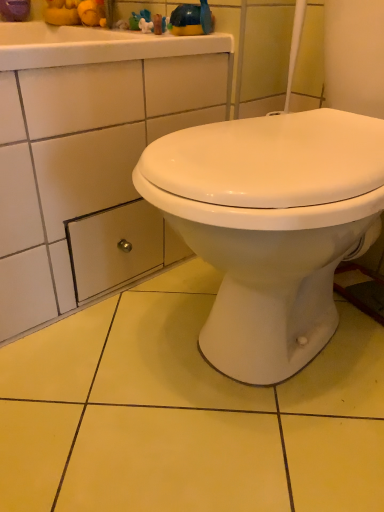
Question: Considering the positions of point (82, 276) and point (175, 31), is point (82, 276) closer or farther from the camera than point (175, 31)?

Choices:
 (A) farther
 (B) closer

Answer: (A)

Question: Considering the positions of metallic silver drawer at lower left and blue rubber duck at upper center in the image, is metallic silver drawer at lower left bigger or smaller than blue rubber duck at upper center?

Choices:
 (A) small
 (B) big

Answer: (B)

Question: From a real-world perspective, is metallic silver drawer at lower left above or below blue rubber duck at upper center?

Choices:
 (A) below
 (B) above

Answer: (A)

Question: From the image's perspective, is blue rubber duck at upper center above or below metallic silver drawer at lower left?

Choices:
 (A) below
 (B) above

Answer: (B)

Question: Is point (203, 18) positioned closer to the camera than point (117, 238)?

Choices:
 (A) farther
 (B) closer

Answer: (B)

Question: Is blue rubber duck at upper center bigger or smaller than metallic silver drawer at lower left?

Choices:
 (A) big
 (B) small

Answer: (B)

Question: From a real-world perspective, relative to metallic silver drawer at lower left, is blue rubber duck at upper center vertically above or below?

Choices:
 (A) above
 (B) below

Answer: (A)